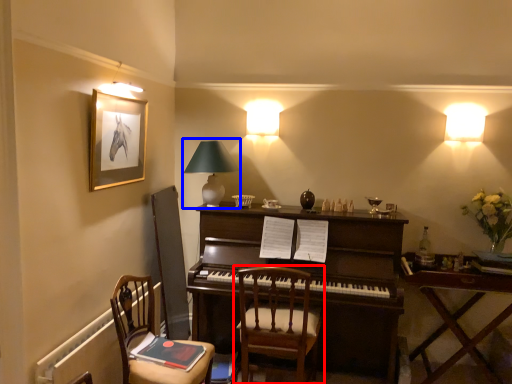
Question: Among these objects, which one is farthest to the camera, chair (highlighted by a red box) or table lamp (highlighted by a blue box)?

Choices:
 (A) chair
 (B) table lamp

Answer: (B)